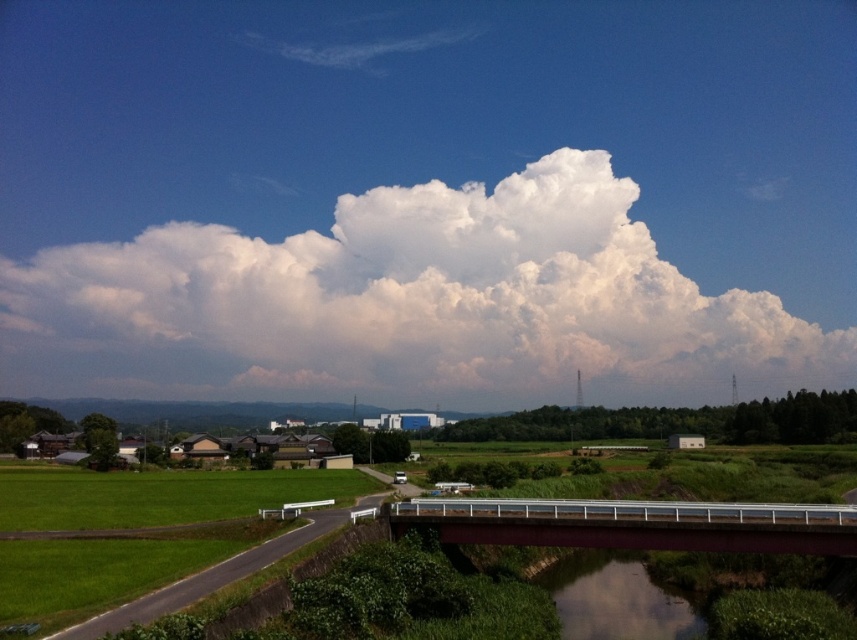
Question: Can you confirm if smooth brown water at bottom center is positioned below silver metallic train at center?

Choices:
 (A) no
 (B) yes

Answer: (B)

Question: Among these objects, which one is nearest to the camera?

Choices:
 (A) metallic gray bridge at center
 (B) white fluffy cloud at upper center
 (C) smooth brown water at bottom center
 (D) silver metallic train at center

Answer: (C)

Question: Which object appears farthest from the camera in this image?

Choices:
 (A) white fluffy cloud at upper center
 (B) green grass at lower left

Answer: (A)

Question: Considering the relative positions of white fluffy cloud at upper center and metallic gray bridge at center in the image provided, where is white fluffy cloud at upper center located with respect to metallic gray bridge at center?

Choices:
 (A) left
 (B) right

Answer: (A)

Question: Considering the relative positions of white fluffy cloud at upper center and green grass at lower left in the image provided, where is white fluffy cloud at upper center located with respect to green grass at lower left?

Choices:
 (A) right
 (B) left

Answer: (A)

Question: Which object appears closest to the camera in this image?

Choices:
 (A) metallic gray bridge at center
 (B) green grass at lower left

Answer: (B)